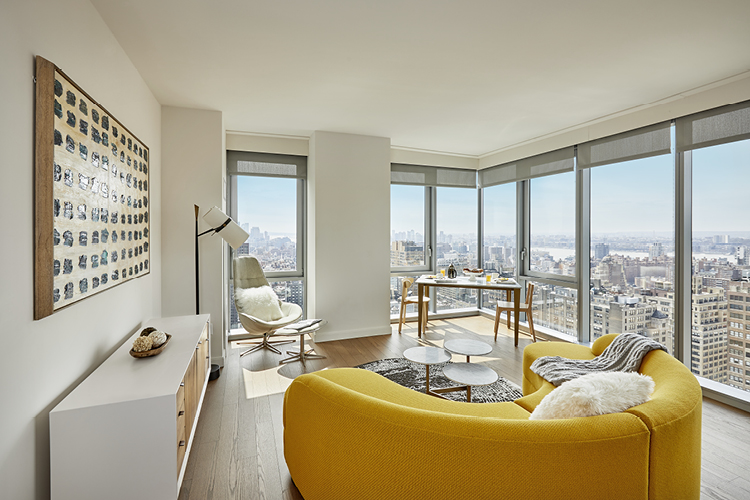
Find the location of a particular element. The width and height of the screenshot is (750, 500). pillows is located at coordinates (604, 379), (252, 297).